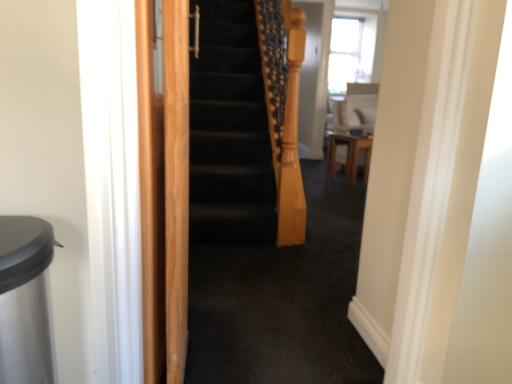
Question: Should I look upward or downward to see light brown wood screen door at left?

Choices:
 (A) up
 (B) down

Answer: (B)

Question: Considering the relative sizes of white glossy chair at upper right and wooden table at center in the image provided, is white glossy chair at upper right thinner than wooden table at center?

Choices:
 (A) no
 (B) yes

Answer: (A)

Question: From a real-world perspective, is white glossy chair at upper right below wooden table at center?

Choices:
 (A) no
 (B) yes

Answer: (A)

Question: Is white glossy chair at upper right taller than wooden table at center?

Choices:
 (A) no
 (B) yes

Answer: (B)

Question: Does white glossy chair at upper right lie behind wooden table at center?

Choices:
 (A) yes
 (B) no

Answer: (A)

Question: Is white glossy chair at upper right smaller than wooden table at center?

Choices:
 (A) yes
 (B) no

Answer: (B)

Question: Is white glossy chair at upper right not inside wooden table at center?

Choices:
 (A) yes
 (B) no

Answer: (A)

Question: Is light brown wood screen door at left further to the viewer compared to white glossy chair at upper right?

Choices:
 (A) no
 (B) yes

Answer: (A)

Question: Is light brown wood screen door at left wider than white glossy chair at upper right?

Choices:
 (A) no
 (B) yes

Answer: (A)

Question: Is the position of light brown wood screen door at left less distant than that of white glossy chair at upper right?

Choices:
 (A) yes
 (B) no

Answer: (A)

Question: Is light brown wood screen door at left positioned with its back to white glossy chair at upper right?

Choices:
 (A) no
 (B) yes

Answer: (A)

Question: Can you confirm if light brown wood screen door at left is smaller than white glossy chair at upper right?

Choices:
 (A) yes
 (B) no

Answer: (A)

Question: Would you consider light brown wood screen door at left to be distant from white glossy chair at upper right?

Choices:
 (A) no
 (B) yes

Answer: (B)

Question: Does wooden table at center lie behind white glossy chair at upper right?

Choices:
 (A) yes
 (B) no

Answer: (B)